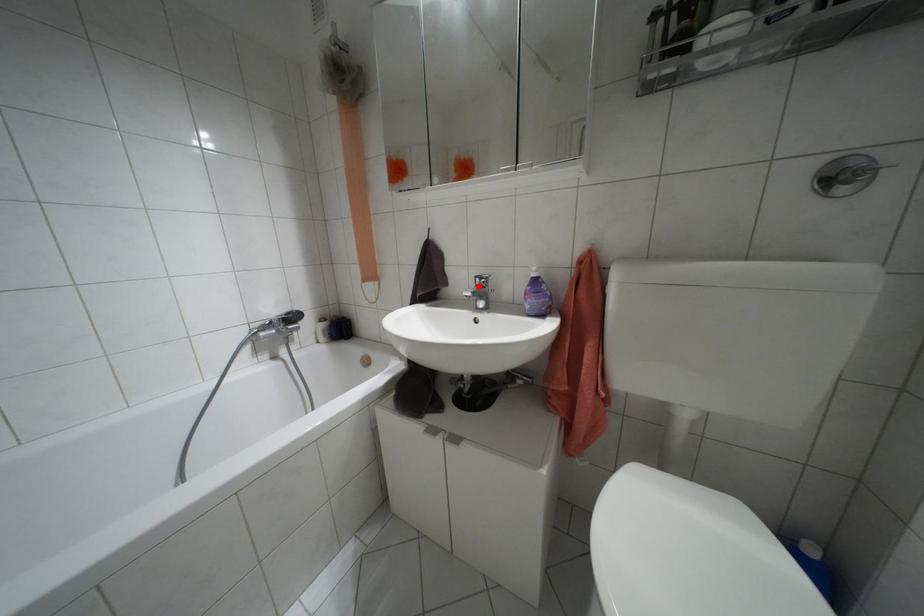
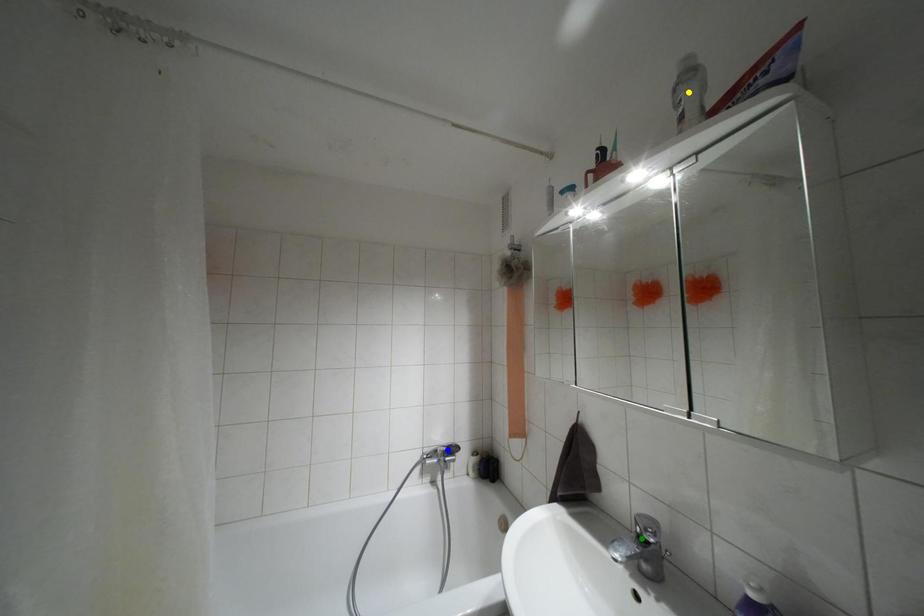
Question: I am providing you with two images of the same scene from different viewpoints. A red point is marked on the first image. You are given multiple points on the second image. Which spot in image 2 lines up with the point in image 1?

Choices:
 (A) yellow point
 (B) green point
 (C) blue point

Answer: (B)